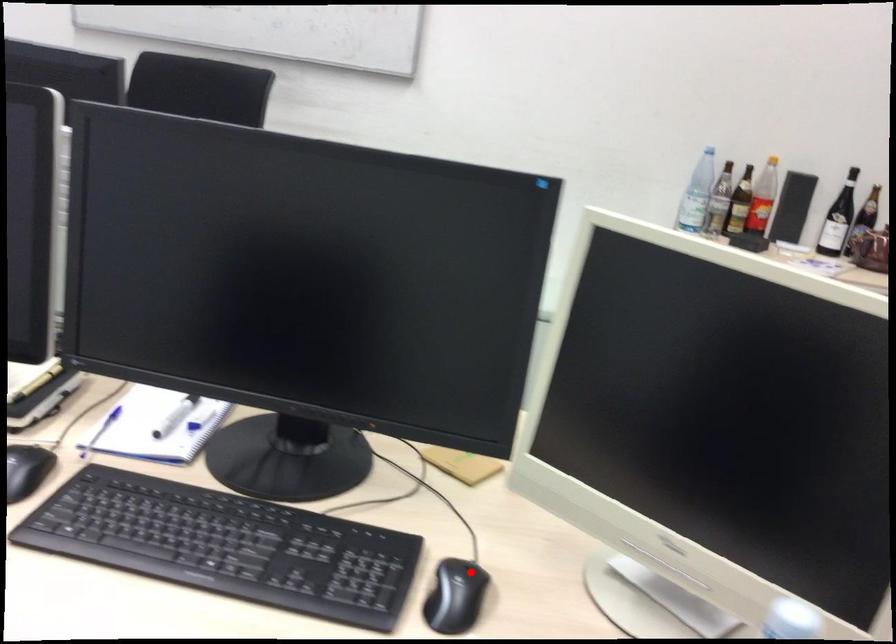
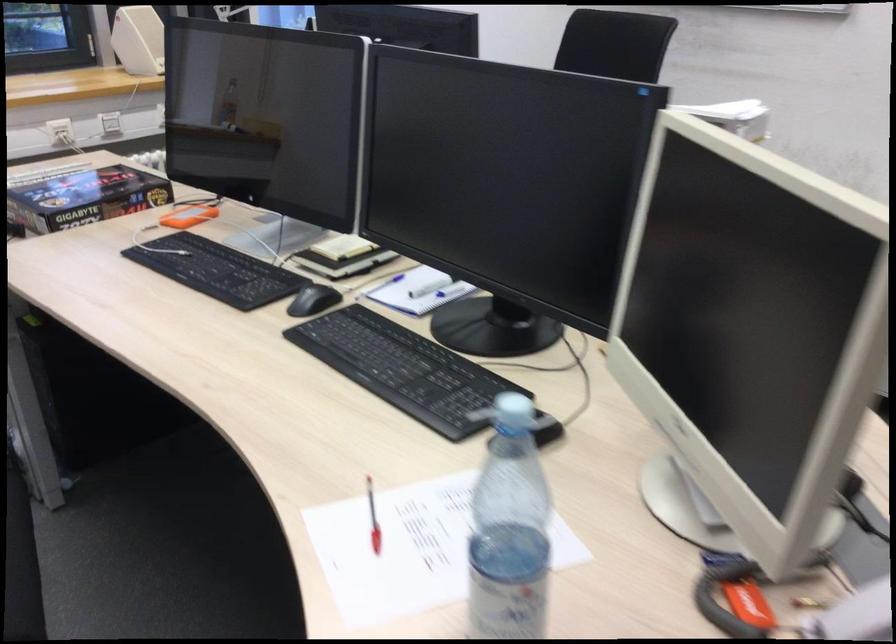
In the second image, find the point that corresponds to the highlighted location in the first image.

(547, 431)